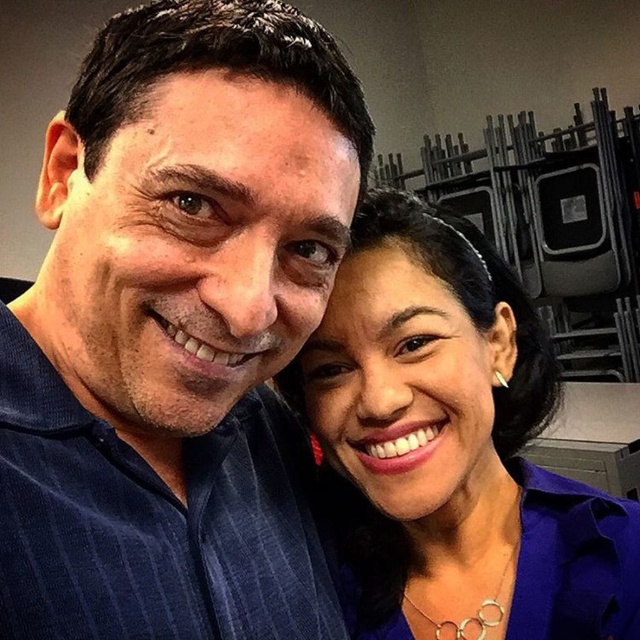
You are taking a photo of two people standing side by side. You notice the blue corduroy shirt at center and the matte purple blouse at center. Which clothing item is located to the left of the other?

The blue corduroy shirt at center is positioned on the left side of matte purple blouse at center.

You are taking a selfie with two people. You notice a point at coordinates [177,332]. Which object in the image corresponds to this point?

The blue corduroy shirt at center is represented by point [177,332].

You are taking a photo of two people standing side by side. You notice the blue corduroy shirt at center and the matte purple blouse at center. Which clothing item is closer to the camera?

The blue corduroy shirt at center is in front of the matte purple blouse at center, so it is closer to the camera.